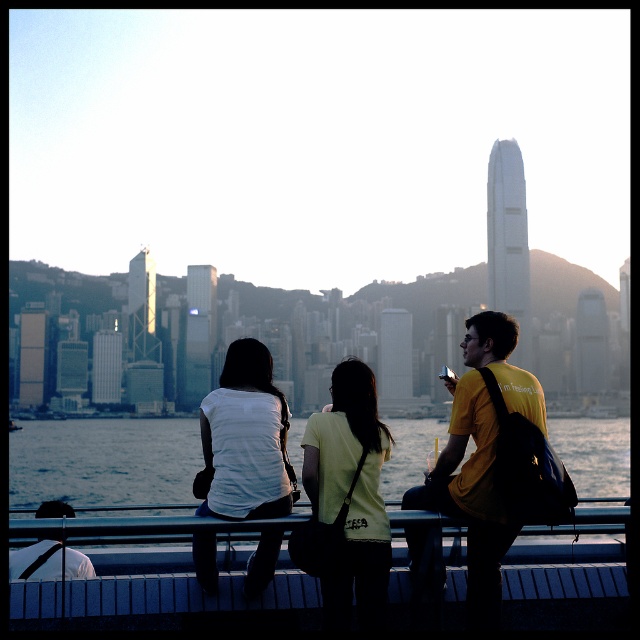
You are a photographer standing in front of the scene. You want to capture a photo where the blue water at center is visible above the white matte shirt at center. Is this possible?

The blue water at center is shorter than white matte shirt at center, so it cannot be visible above the white matte shirt at center in the photo.

Looking at this image, you are a photographer standing in front of the scene. You want to take a photo of the blue water at center and the white matte shirt at center. Can you frame both objects in the same shot without moving the camera?

The blue water at center is below the white matte shirt at center, so yes, you can frame both objects in the same shot without moving the camera since they are positioned vertically aligned.